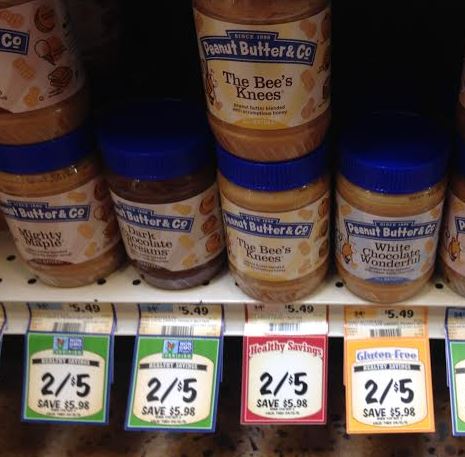
Image resolution: width=465 pixels, height=457 pixels. Identify the location of shelves. (219, 448), (215, 290).